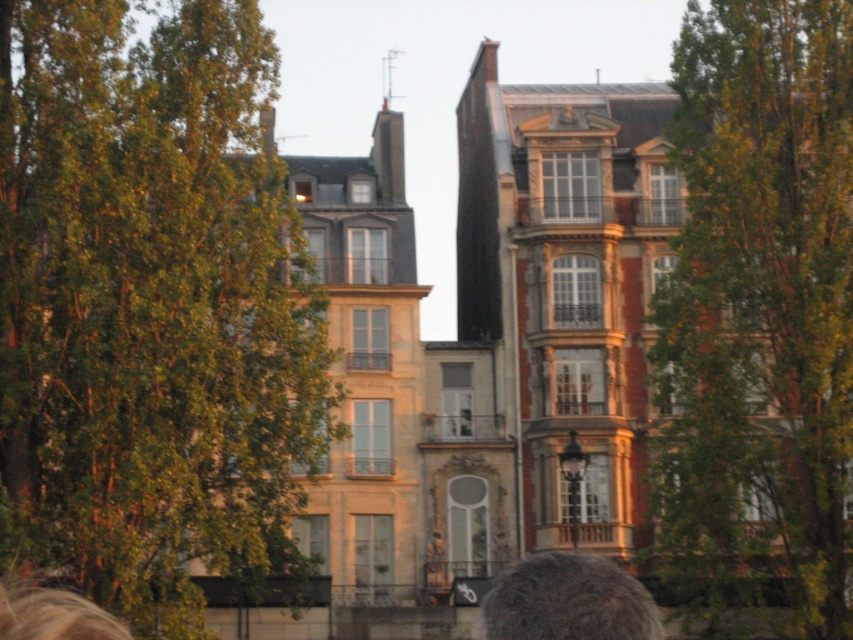
Question: Is green leafy tree at left to the left of green leafy tree at upper right from the viewer's perspective?

Choices:
 (A) no
 (B) yes

Answer: (B)

Question: Where is green leafy tree at left located in relation to green leafy tree at upper right in the image?

Choices:
 (A) left
 (B) right

Answer: (A)

Question: Which of the following is the closest to the observer?

Choices:
 (A) green leafy tree at upper right
 (B) green leafy tree at left

Answer: (B)

Question: Which of the following is the closest to the observer?

Choices:
 (A) gray hair at lower center
 (B) green leafy tree at left
 (C) green leafy tree at upper right

Answer: (A)

Question: Is green leafy tree at left below green leafy tree at upper right?

Choices:
 (A) yes
 (B) no

Answer: (B)

Question: Which object is positioned closest to the green leafy tree at left?

Choices:
 (A) gray hair at lower center
 (B) green leafy tree at upper right

Answer: (B)